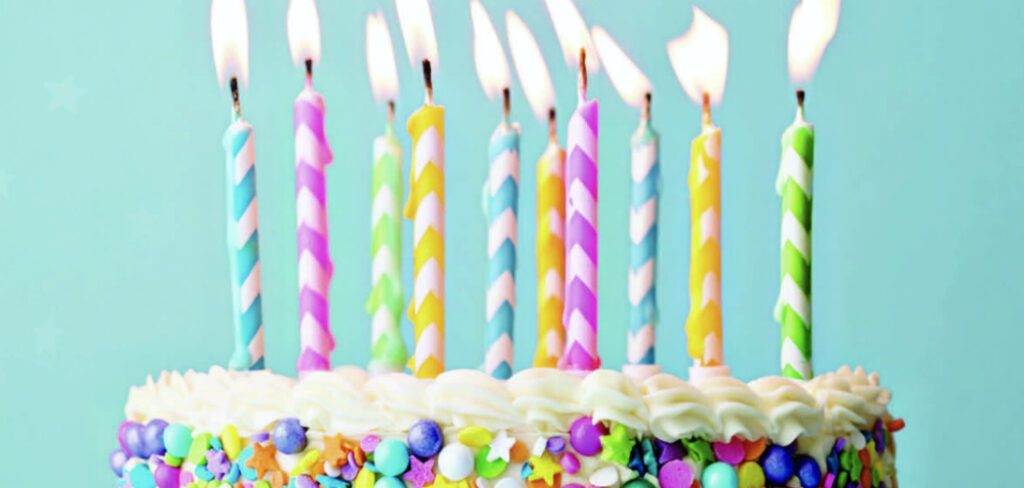
This screenshot has height=488, width=1024. What are the coordinates of `flames on the birthday candles` in the screenshot? It's located at (229, 41), (300, 31), (386, 70), (423, 38), (487, 68), (522, 63), (571, 43), (612, 49), (809, 45), (708, 50).